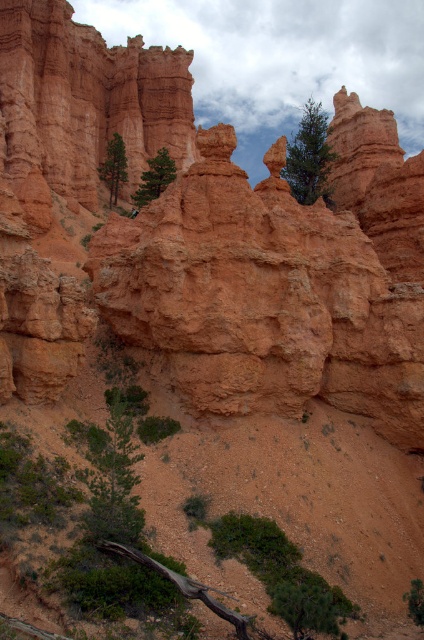
Which of these two, green textured tree at upper center or green leafy tree at lower right, stands shorter?

With less height is green leafy tree at lower right.

Is point (295, 132) less distant than point (420, 621)?

No, it is not.

Which is in front, point (298, 179) or point (415, 586)?

Point (415, 586) is in front.

Locate an element on the screen. The height and width of the screenshot is (640, 424). green textured tree at upper center is located at coordinates (309, 157).

From the picture: Does green textured tree at upper center appear under green matte tree at center?

No, green textured tree at upper center is not below green matte tree at center.

Does green textured tree at upper center have a lesser height compared to green matte tree at center?

In fact, green textured tree at upper center may be taller than green matte tree at center.

Who is more forward, (329, 157) or (145, 172)?

Point (329, 157)

Find the location of a particular element. Image resolution: width=424 pixels, height=640 pixels. green textured tree at upper center is located at coordinates (309, 157).

Between green matte tree at center and green leafy tree at lower right, which one has less height?

green leafy tree at lower right is shorter.

Does green matte tree at center have a lesser height compared to green leafy tree at lower right?

No, green matte tree at center is not shorter than green leafy tree at lower right.

Is point (150, 180) behind point (415, 616)?

Yes, it is behind point (415, 616).

Locate an element on the screen. green matte tree at center is located at coordinates (155, 177).